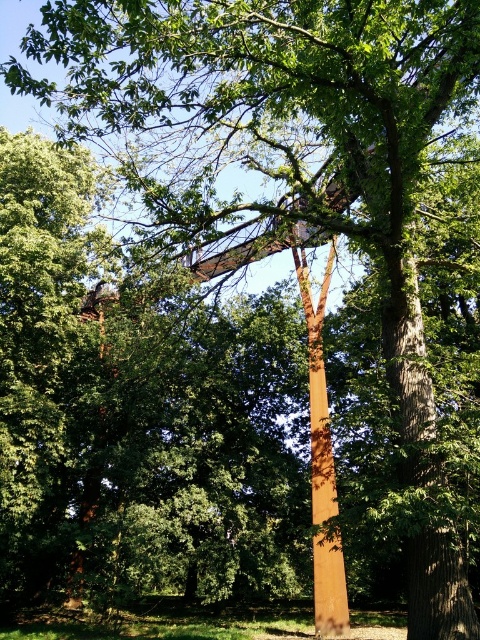
Does smooth brown tree trunk at center have a greater height compared to golden polished pole at center?

In fact, smooth brown tree trunk at center may be shorter than golden polished pole at center.

Which is in front, point (419, 317) or point (336, 492)?

Point (419, 317)

This screenshot has height=640, width=480. In order to click on smooth brown tree trunk at center in this screenshot , I will do `click(422, 468)`.